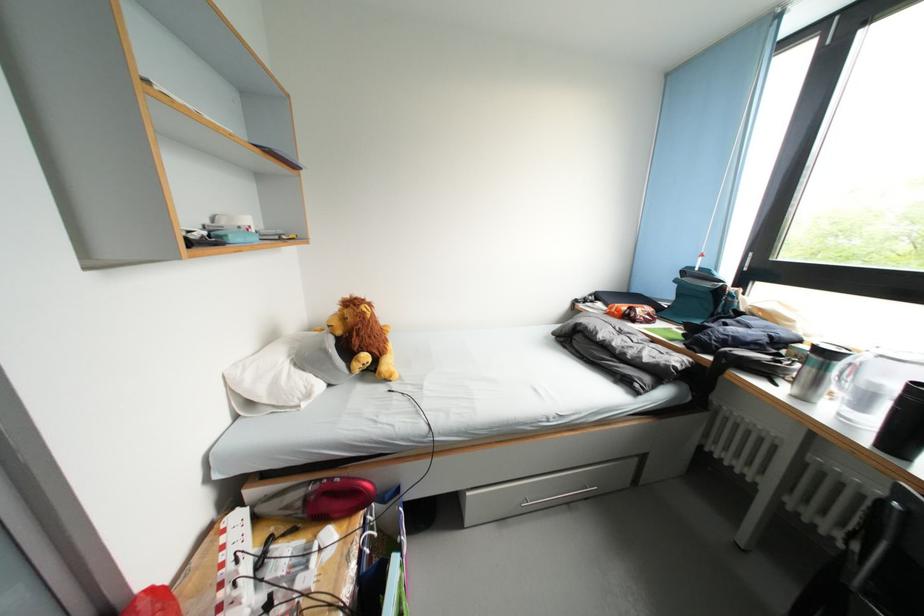
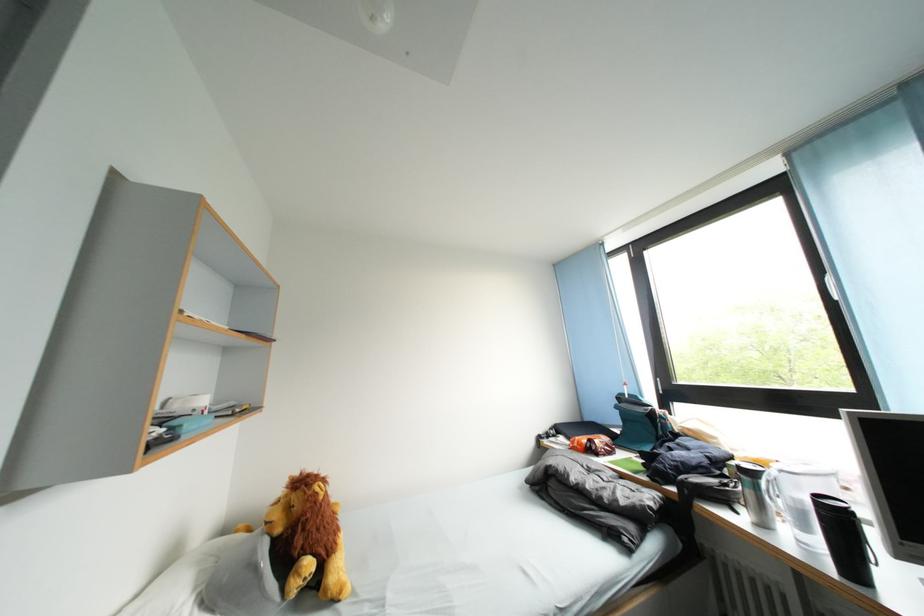
Question: I am providing you with two images of the same scene from different viewpoints. After the viewpoint changes to image2, which objects are now occluded?

Choices:
 (A) clear pitcher
 (B) white window handle
 (C) blind pull handle
 (D) none of these

Answer: (D)